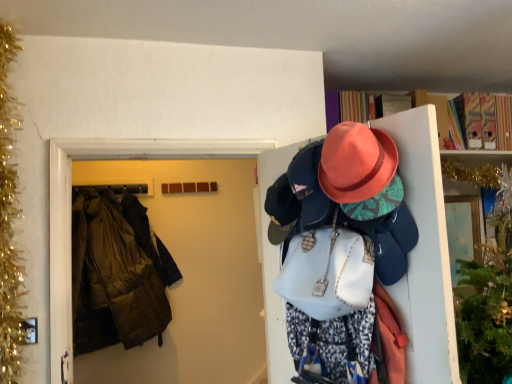
Question: Is the depth of matte pink hat at upper right less than that of gold tinsel garland at left?

Choices:
 (A) no
 (B) yes

Answer: (B)

Question: Does matte pink hat at upper right have a lesser height compared to gold tinsel garland at left?

Choices:
 (A) yes
 (B) no

Answer: (A)

Question: Can you confirm if matte pink hat at upper right is positioned to the left of gold tinsel garland at left?

Choices:
 (A) no
 (B) yes

Answer: (A)

Question: Can you confirm if matte pink hat at upper right is smaller than gold tinsel garland at left?

Choices:
 (A) yes
 (B) no

Answer: (B)

Question: Is matte pink hat at upper right taller than gold tinsel garland at left?

Choices:
 (A) no
 (B) yes

Answer: (A)

Question: In the image, is brown fabric coat at left on the left side or the right side of matte pink hat at upper right?

Choices:
 (A) left
 (B) right

Answer: (A)

Question: From a real-world perspective, relative to matte pink hat at upper right, is brown fabric coat at left vertically above or below?

Choices:
 (A) below
 (B) above

Answer: (B)

Question: Would you say brown fabric coat at left is inside or outside matte pink hat at upper right?

Choices:
 (A) inside
 (B) outside

Answer: (B)

Question: From the image's perspective, is brown fabric coat at left located above or below matte pink hat at upper right?

Choices:
 (A) above
 (B) below

Answer: (A)

Question: In the image, is dark brown leather jacket at left positioned in front of or behind matte pink hat at upper right?

Choices:
 (A) front
 (B) behind

Answer: (B)

Question: In terms of width, does dark brown leather jacket at left look wider or thinner when compared to matte pink hat at upper right?

Choices:
 (A) wide
 (B) thin

Answer: (B)

Question: Would you say dark brown leather jacket at left is to the left or to the right of matte pink hat at upper right in the picture?

Choices:
 (A) left
 (B) right

Answer: (A)

Question: Is dark brown leather jacket at left inside the boundaries of matte pink hat at upper right, or outside?

Choices:
 (A) inside
 (B) outside

Answer: (B)

Question: From their relative heights in the image, would you say matte pink hat at upper right is taller or shorter than dark brown leather jacket at left?

Choices:
 (A) short
 (B) tall

Answer: (B)

Question: Considering their positions, is matte pink hat at upper right located in front of or behind dark brown leather jacket at left?

Choices:
 (A) behind
 (B) front

Answer: (B)